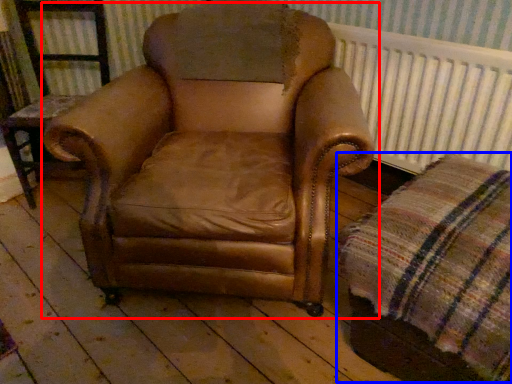
Question: Which object appears closest to the camera in this image, chair (highlighted by a red box) or plaid (highlighted by a blue box)?

Choices:
 (A) chair
 (B) plaid

Answer: (B)